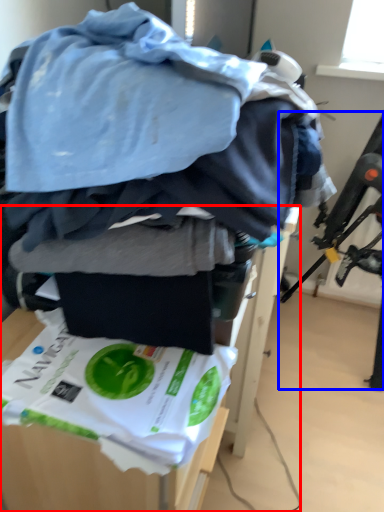
Question: Which of the following is the farthest to the observer, furniture (highlighted by a red box) or swivel chair (highlighted by a blue box)?

Choices:
 (A) furniture
 (B) swivel chair

Answer: (B)